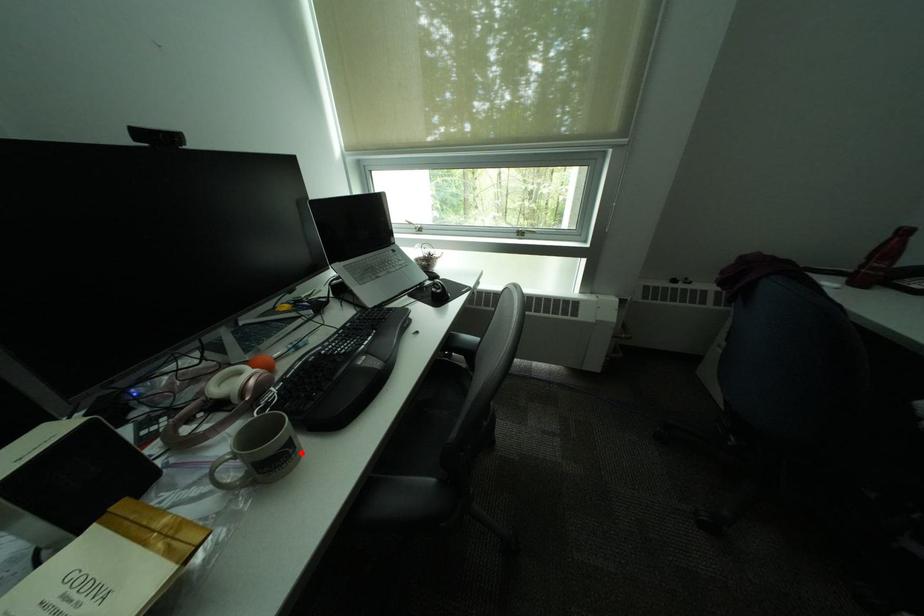
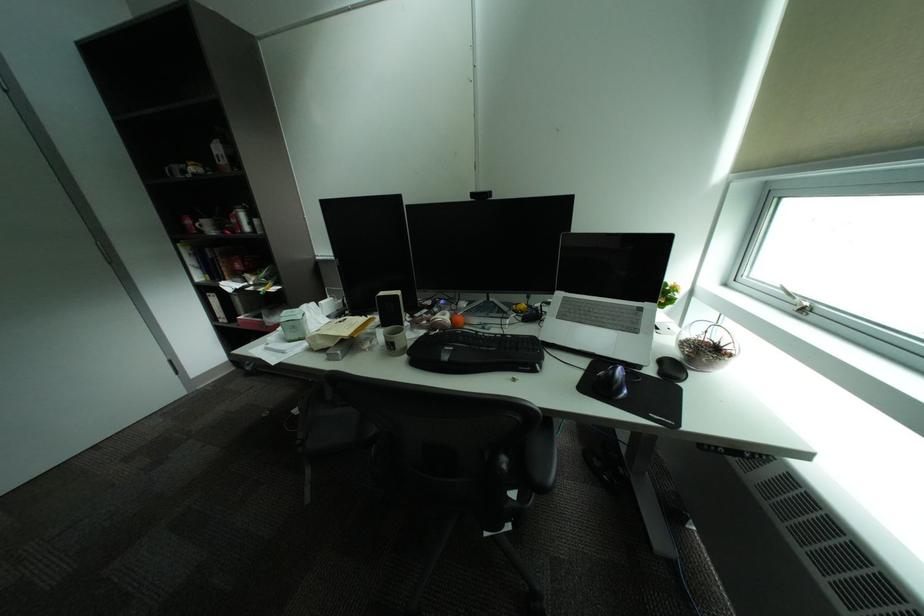
Locate, in the second image, the point that corresponds to the highlighted location in the first image.

(403, 349)